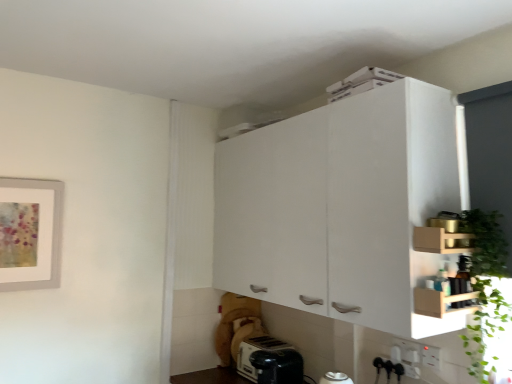
Question: Is white plastic toaster at lower center taller than white plastic electric outlet at lower right, which is the 2th electric outlet from front to back?

Choices:
 (A) no
 (B) yes

Answer: (B)

Question: Considering the relative sizes of white plastic toaster at lower center and white plastic electric outlet at lower right, which is the 2th electric outlet from front to back, in the image provided, is white plastic toaster at lower center thinner than white plastic electric outlet at lower right, which is the 2th electric outlet from front to back,?

Choices:
 (A) yes
 (B) no

Answer: (B)

Question: Is white plastic toaster at lower center oriented towards white plastic electric outlet at lower right, which is the 2th electric outlet from front to back?

Choices:
 (A) yes
 (B) no

Answer: (B)

Question: Is white plastic toaster at lower center to the left of white plastic electric outlet at lower right, which ranks as the 2th electric outlet in right-to-left order, from the viewer's perspective?

Choices:
 (A) no
 (B) yes

Answer: (B)

Question: Does white plastic toaster at lower center have a lesser height compared to white plastic electric outlet at lower right, which appears as the 1th electric outlet when viewed from the back?

Choices:
 (A) no
 (B) yes

Answer: (A)

Question: From their relative heights in the image, would you say white plastic toaster at lower center is taller or shorter than green leafy plant at right?

Choices:
 (A) short
 (B) tall

Answer: (A)

Question: Is white plastic toaster at lower center to the left or to the right of green leafy plant at right in the image?

Choices:
 (A) right
 (B) left

Answer: (B)

Question: From the image's perspective, relative to green leafy plant at right, is white plastic toaster at lower center above or below?

Choices:
 (A) below
 (B) above

Answer: (A)

Question: Considering their positions, is white plastic toaster at lower center located in front of or behind green leafy plant at right?

Choices:
 (A) front
 (B) behind

Answer: (B)

Question: Relative to white plastic toaster at lower center, is white plastic electric outlet at lower right, which ranks as the 2th electric outlet in right-to-left order, in front or behind?

Choices:
 (A) behind
 (B) front

Answer: (B)

Question: From a real-world perspective, is white plastic electric outlet at lower right, which appears as the 1th electric outlet when viewed from the back, positioned above or below white plastic toaster at lower center?

Choices:
 (A) below
 (B) above

Answer: (B)

Question: Looking at the image, does white plastic electric outlet at lower right, acting as the 1th electric outlet starting from the left, seem bigger or smaller compared to white plastic toaster at lower center?

Choices:
 (A) small
 (B) big

Answer: (A)

Question: Is white plastic electric outlet at lower right, which appears as the 1th electric outlet when viewed from the back, spatially inside white plastic toaster at lower center, or outside of it?

Choices:
 (A) inside
 (B) outside

Answer: (B)

Question: Is white plastic electric outlet at lower right, placed as the 1th electric outlet when sorted from right to left, inside or outside of wooden shelf at upper right, which is the 2th cabinetry from back to front?

Choices:
 (A) inside
 (B) outside

Answer: (B)

Question: In terms of size, does white plastic electric outlet at lower right, placed as the 1th electric outlet when sorted from right to left, appear bigger or smaller than wooden shelf at upper right, arranged as the 1th cabinetry when viewed from the front?

Choices:
 (A) big
 (B) small

Answer: (B)